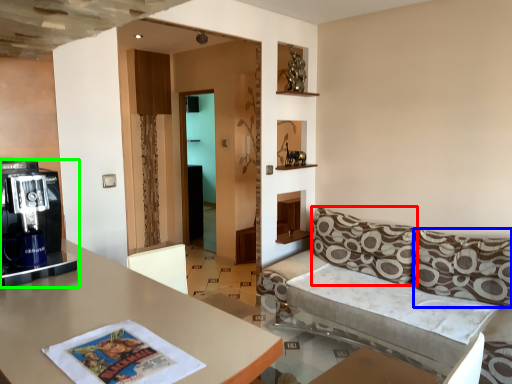
Question: Considering the real-world distances, which object is closest to pillow (highlighted by a red box)? pillow (highlighted by a blue box) or coffee machine (highlighted by a green box).

Choices:
 (A) pillow
 (B) coffee machine

Answer: (A)